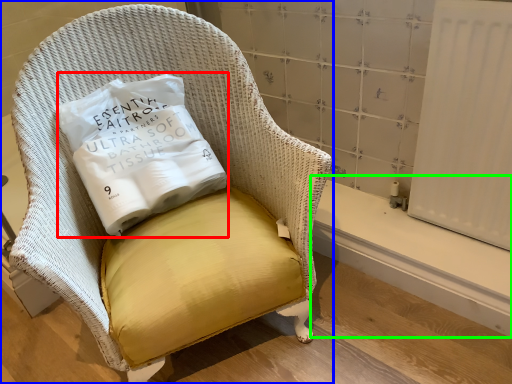
Question: Which object is positioned farthest from pillow (highlighted by a red box)? Select from chair (highlighted by a blue box) and window sill (highlighted by a green box).

Choices:
 (A) chair
 (B) window sill

Answer: (B)